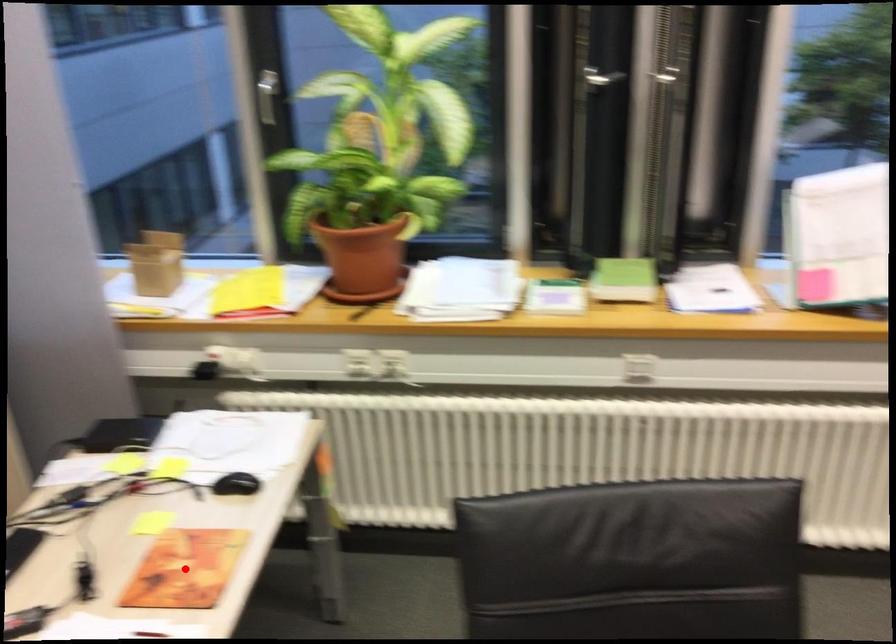
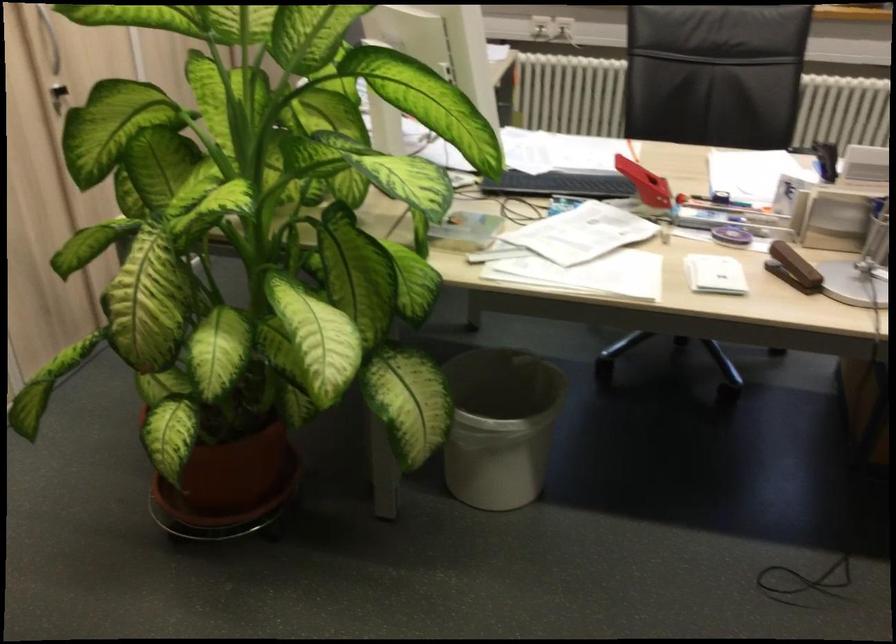
Question: I am providing you with two images of the same scene from different viewpoints. A red point is marked on the first image. At the location where the point appears in image 1, is it still visible in image 2?

Choices:
 (A) Yes
 (B) No

Answer: (B)